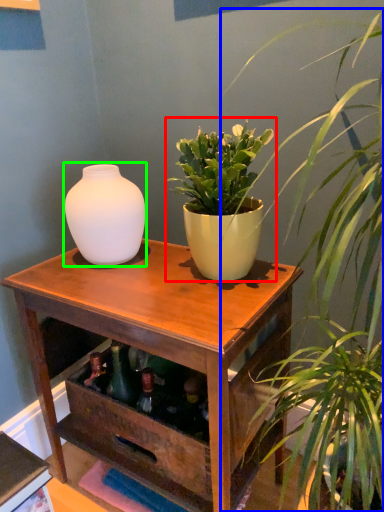
Question: Which object is positioned farthest from houseplant (highlighted by a red box)? Select from houseplant (highlighted by a blue box) and vase (highlighted by a green box).

Choices:
 (A) houseplant
 (B) vase

Answer: (B)